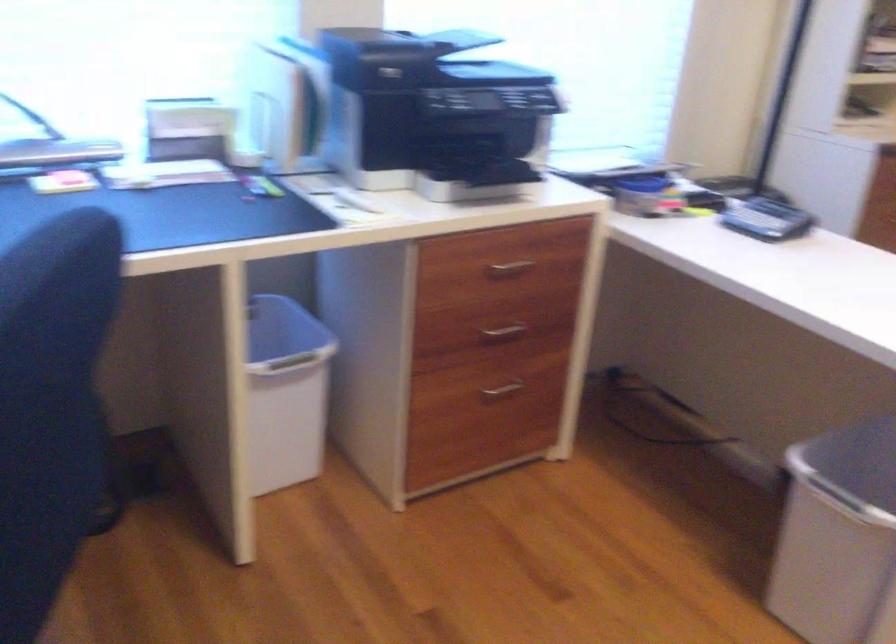
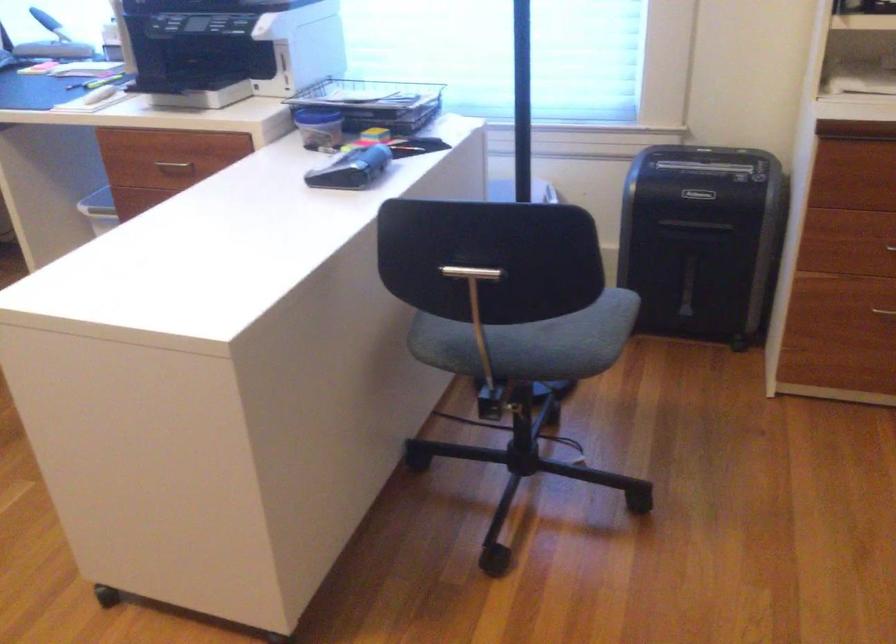
Find the pixel in the second image that matches (x=787, y=225) in the first image.

(351, 169)